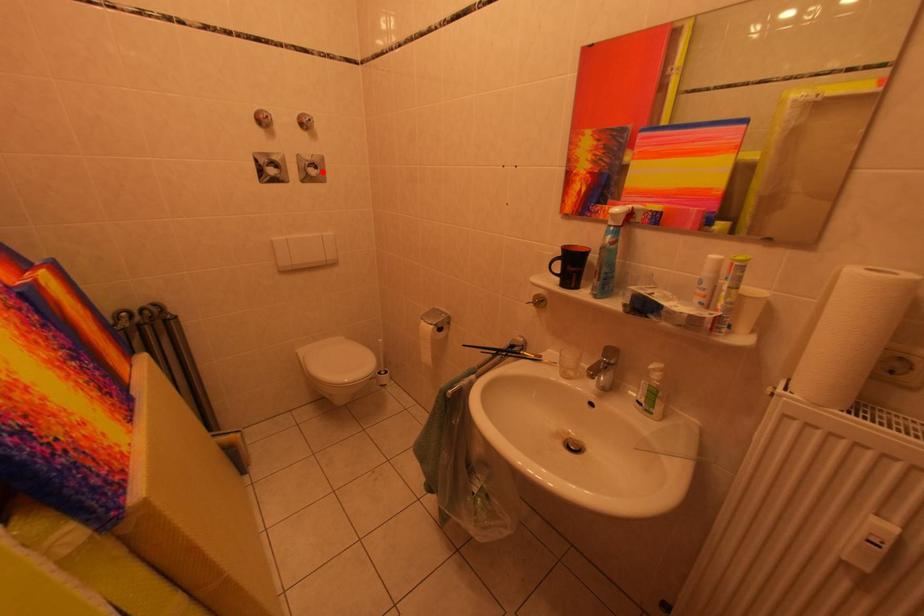
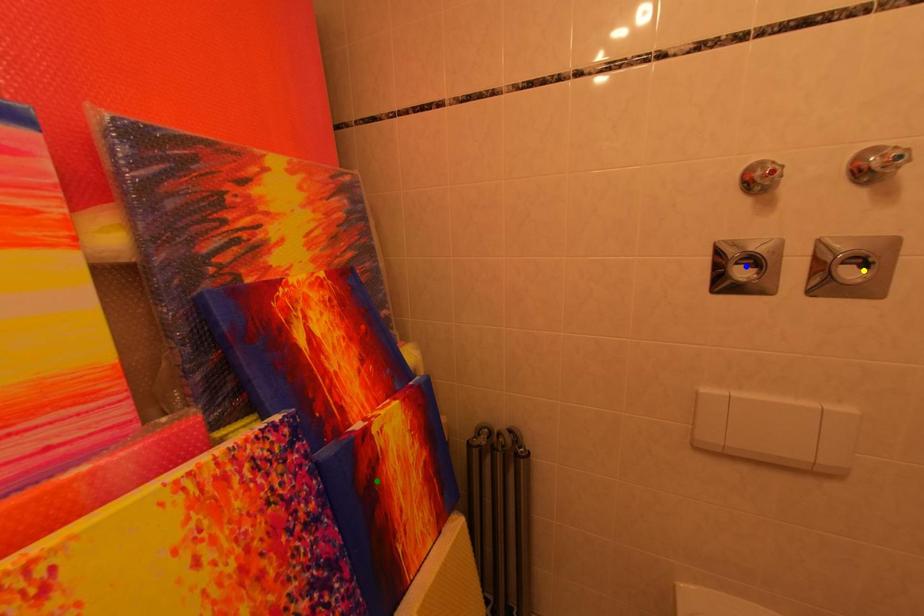
Question: I am providing you with two images of the same scene from different viewpoints. A red point is marked on the first image. You are given multiple points on the second image. Which spot in image 2 lines up with the point in image 1?

Choices:
 (A) yellow point
 (B) blue point
 (C) green point

Answer: (A)